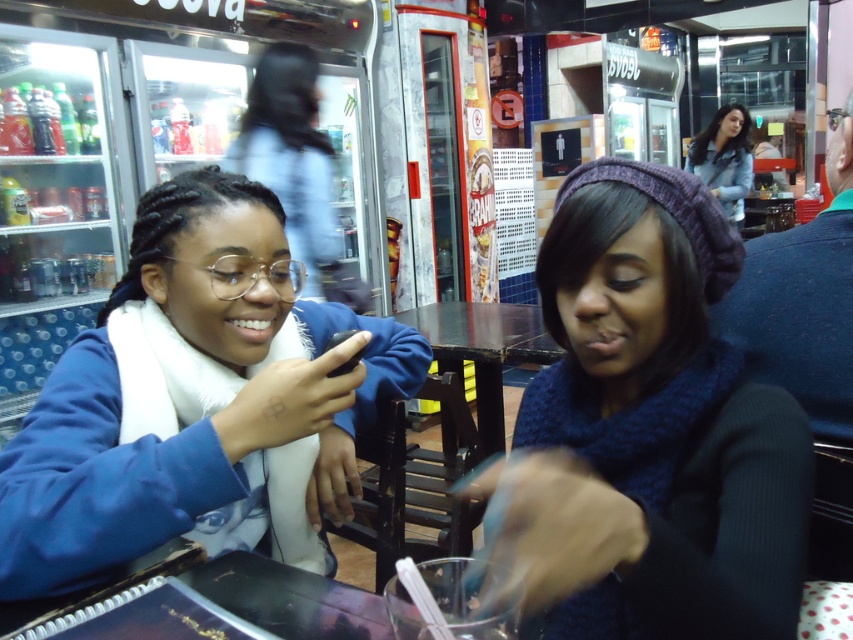
Question: Which of the following is the farthest from the observer?

Choices:
 (A) denim jacket at upper right
 (B) knitted purple beanie at upper right

Answer: (A)

Question: Does blue fleece jacket at left come behind denim jacket at upper right?

Choices:
 (A) yes
 (B) no

Answer: (B)

Question: Does knitted purple beanie at upper right appear on the left side of blue fleece jacket at left?

Choices:
 (A) no
 (B) yes

Answer: (A)

Question: Which object appears farthest from the camera in this image?

Choices:
 (A) blue fleece jacket at left
 (B) knitted purple beanie at upper right
 (C) denim jacket at upper right

Answer: (C)

Question: Estimate the real-world distances between objects in this image. Which object is closer to the denim jacket at upper right?

Choices:
 (A) knitted purple beanie at upper right
 (B) blue fleece jacket at left

Answer: (B)

Question: Does knitted purple beanie at upper right come in front of dark wood table at center?

Choices:
 (A) yes
 (B) no

Answer: (A)